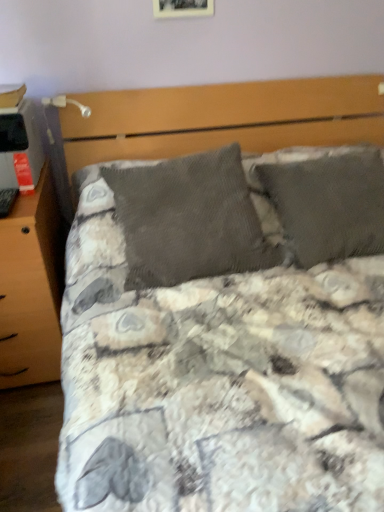
Image resolution: width=384 pixels, height=512 pixels. Describe the element at coordinates (20, 147) in the screenshot. I see `matte black desktop at left` at that location.

This screenshot has height=512, width=384. What do you see at coordinates (31, 287) in the screenshot? I see `wooden nightstand at left` at bounding box center [31, 287].

Locate an element on the screen. This screenshot has height=512, width=384. metallic silver table lamp at upper left is located at coordinates (66, 104).

Between matte black desktop at left and wooden photo frame at upper center, which one has less height?

Standing shorter between the two is matte black desktop at left.

Would you say matte black desktop at left is a long distance from wooden photo frame at upper center?

That's not correct — matte black desktop at left is a little close to wooden photo frame at upper center.

Identify the location of desktop on the left of the wooden photo frame at upper center. point(20,147).

Between metallic silver table lamp at upper left and matte black desktop at left, which one is positioned in front?

matte black desktop at left.

Looking at their sizes, would you say metallic silver table lamp at upper left is wider or thinner than matte black desktop at left?

Clearly, metallic silver table lamp at upper left has more width compared to matte black desktop at left.

Consider the image. Is metallic silver table lamp at upper left with matte black desktop at left?

No, metallic silver table lamp at upper left is not making contact with matte black desktop at left.

Consider the image. How many degrees apart are the facing directions of metallic silver table lamp at upper left and matte black desktop at left?

The angular difference between metallic silver table lamp at upper left and matte black desktop at left is 1.3 degrees.

How different are the orientations of wooden photo frame at upper center and wooden nightstand at left in degrees?

The facing directions of wooden photo frame at upper center and wooden nightstand at left are 0.256 degrees apart.

Would you say wooden photo frame at upper center is outside wooden nightstand at left?

Absolutely, wooden photo frame at upper center is external to wooden nightstand at left.

You are a GUI agent. You are given a task and a screenshot of the screen. Output one action in this format:
    pyautogui.click(x=<x>, y=<y>)
    Task: Click on the nightstand below the wooden photo frame at upper center (from the image's perspective)
    
    Given the screenshot: What is the action you would take?
    pyautogui.click(x=31, y=287)

From a real-world perspective, between wooden photo frame at upper center and wooden nightstand at left, who is vertically higher?

From a 3D spatial view, wooden photo frame at upper center is above.

Could you tell me if metallic silver table lamp at upper left is facing wooden nightstand at left?

No, metallic silver table lamp at upper left is not oriented towards wooden nightstand at left.

Who is taller, metallic silver table lamp at upper left or wooden nightstand at left?

wooden nightstand at left.

How different are the orientations of metallic silver table lamp at upper left and wooden nightstand at left in degrees?

The angle between the facing direction of metallic silver table lamp at upper left and the facing direction of wooden nightstand at left is 0.255 degrees.

Based on the photo, considering the sizes of metallic silver table lamp at upper left and wooden nightstand at left in the image, is metallic silver table lamp at upper left wider or thinner than wooden nightstand at left?

metallic silver table lamp at upper left is thinner than wooden nightstand at left.

Identify the location of nightstand below the wooden photo frame at upper center (from the image's perspective). (31, 287).

Is wooden nightstand at left inside or outside of wooden photo frame at upper center?

wooden nightstand at left exists outside the volume of wooden photo frame at upper center.

Is wooden nightstand at left facing away from wooden photo frame at upper center?

wooden nightstand at left is not turned away from wooden photo frame at upper center.

Is point (1, 292) in front of point (161, 9)?

That is True.

Does wooden photo frame at upper center appear on the right side of metallic silver table lamp at upper left?

Indeed, wooden photo frame at upper center is positioned on the right side of metallic silver table lamp at upper left.

Do you think wooden photo frame at upper center is within metallic silver table lamp at upper left, or outside of it?

wooden photo frame at upper center exists outside the volume of metallic silver table lamp at upper left.

Could you tell me if wooden photo frame at upper center is turned towards metallic silver table lamp at upper left?

No, wooden photo frame at upper center does not turn towards metallic silver table lamp at upper left.

Can you confirm if wooden photo frame at upper center is thinner than metallic silver table lamp at upper left?

Correct, the width of wooden photo frame at upper center is less than that of metallic silver table lamp at upper left.

Between wooden photo frame at upper center and matte black desktop at left, which one has smaller width?

With smaller width is wooden photo frame at upper center.

Would you say wooden photo frame at upper center is outside matte black desktop at left?

Absolutely, wooden photo frame at upper center is external to matte black desktop at left.

Between point (196, 13) and point (22, 133), which one is positioned behind?

The point (196, 13) is farther from the camera.

Does wooden photo frame at upper center have a larger size compared to matte black desktop at left?

Incorrect, wooden photo frame at upper center is not larger than matte black desktop at left.

At what (x,y) coordinates should I click in order to perform the action: click on picture frame on the right side of matte black desktop at left. Please return your answer as a coordinate pair (x, y). The height and width of the screenshot is (512, 384). Looking at the image, I should click on coord(182,8).

Locate an element on the screen. Image resolution: width=384 pixels, height=512 pixels. desktop that is on the left side of metallic silver table lamp at upper left is located at coordinates (20, 147).

From the image, which object appears to be nearer to wooden photo frame at upper center, wooden nightstand at left or metallic silver table lamp at upper left?

metallic silver table lamp at upper left is closer to wooden photo frame at upper center.

Looking at the image, which one is located further to matte black desktop at left, metallic silver table lamp at upper left or wooden photo frame at upper center?

The object further to matte black desktop at left is wooden photo frame at upper center.

When comparing their distances from metallic silver table lamp at upper left, does wooden nightstand at left or matte black desktop at left seem closer?

matte black desktop at left is closer to metallic silver table lamp at upper left.

Estimate the real-world distances between objects in this image. Which object is further from wooden photo frame at upper center, matte black desktop at left or metallic silver table lamp at upper left?

matte black desktop at left.

Which object lies further to the anchor point matte black desktop at left, wooden photo frame at upper center or wooden nightstand at left?

Among the two, wooden photo frame at upper center is located further to matte black desktop at left.

Based on their spatial positions, is metallic silver table lamp at upper left or wooden nightstand at left further from matte black desktop at left?

The object further to matte black desktop at left is wooden nightstand at left.

Looking at the image, which one is located further to wooden photo frame at upper center, matte black desktop at left or wooden nightstand at left?

wooden nightstand at left lies further to wooden photo frame at upper center than the other object.

From the image, which object appears to be nearer to matte black desktop at left, wooden photo frame at upper center or metallic silver table lamp at upper left?

metallic silver table lamp at upper left.

You are a GUI agent. You are given a task and a screenshot of the screen. Output one action in this format:
    pyautogui.click(x=<x>, y=<y>)
    Task: Click on the table lamp between wooden photo frame at upper center and wooden nightstand at left vertically
    The width and height of the screenshot is (384, 512).
    Given the screenshot: What is the action you would take?
    pyautogui.click(x=66, y=104)

At what (x,y) coordinates should I click in order to perform the action: click on desktop between metallic silver table lamp at upper left and wooden nightstand at left in the up-down direction. Please return your answer as a coordinate pair (x, y). Looking at the image, I should click on click(20, 147).

Find the location of a particular element. The height and width of the screenshot is (512, 384). desktop between wooden photo frame at upper center and wooden nightstand at left in the up-down direction is located at coordinates (20, 147).

This screenshot has height=512, width=384. In order to click on table lamp between wooden photo frame at upper center and matte black desktop at left from top to bottom in this screenshot , I will do `click(66, 104)`.